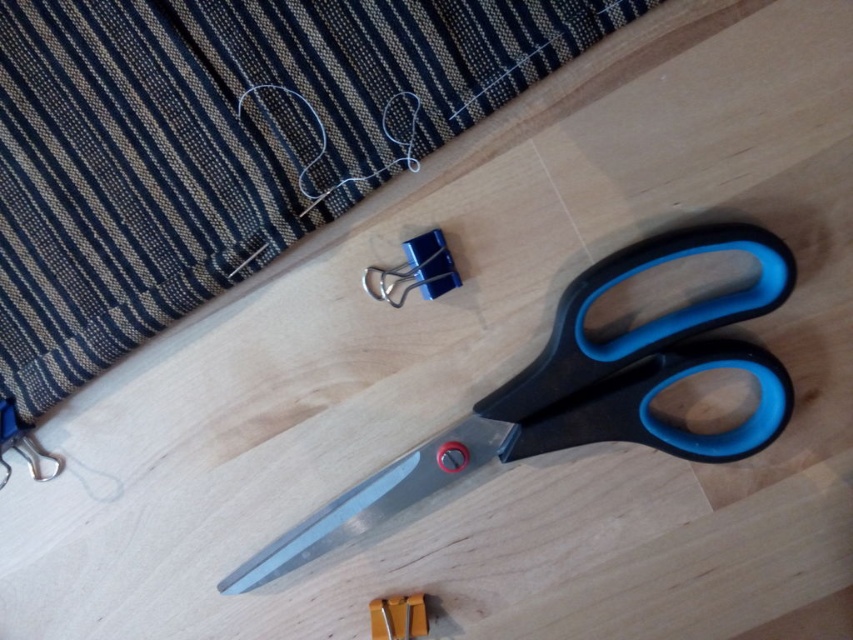
Question: Is metallic silver blade at lower center to the left of yellow plastic ruler at lower center from the viewer's perspective?

Choices:
 (A) yes
 (B) no

Answer: (A)

Question: Is metallic blue binder clip at center below yellow plastic ruler at lower center?

Choices:
 (A) yes
 (B) no

Answer: (B)

Question: Does yellow plastic ruler at lower center have a greater width compared to metallic silver scissors at lower left?

Choices:
 (A) yes
 (B) no

Answer: (A)

Question: Which object is the farthest from the textured fabric at upper left?

Choices:
 (A) metallic blue scissors at center
 (B) metallic silver scissors at lower left
 (C) metallic silver blade at lower center

Answer: (C)

Question: Which object is closer to the camera taking this photo?

Choices:
 (A) metallic silver blade at lower center
 (B) metallic blue binder clip at center

Answer: (B)

Question: Based on their relative distances, which object is farther from the metallic blue binder clip at center?

Choices:
 (A) metallic blue scissors at center
 (B) metallic silver blade at lower center
 (C) metallic silver scissors at lower left

Answer: (C)